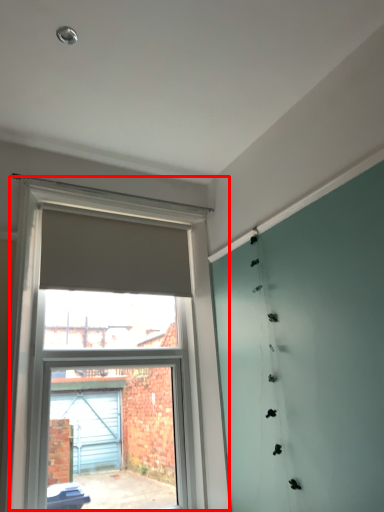
Question: From the image's perspective, what is the correct spatial positioning of window (annotated by the red box) in reference to curtain?

Choices:
 (A) above
 (B) below

Answer: (B)